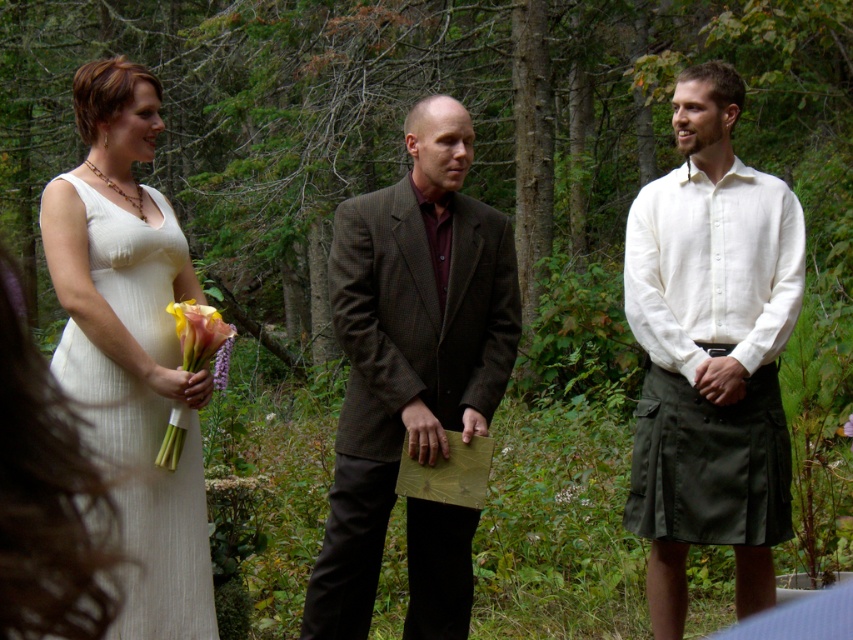
Question: Which point is farther from the camera taking this photo?

Choices:
 (A) (225, 330)
 (B) (213, 636)
 (C) (723, 92)

Answer: (C)

Question: Can you confirm if white linen shirt at center is thinner than soft pastel calla lilies at left?

Choices:
 (A) yes
 (B) no

Answer: (B)

Question: Can you confirm if brown wool suit at center is smaller than soft pink calla lily at left?

Choices:
 (A) yes
 (B) no

Answer: (B)

Question: Which is farther from the white linen shirt at center?

Choices:
 (A) soft pastel calla lilies at left
 (B) soft pink calla lily at left

Answer: (A)

Question: Can you confirm if white textured dress at left is smaller than soft pastel calla lilies at left?

Choices:
 (A) yes
 (B) no

Answer: (B)

Question: Which of the following is the closest to the observer?

Choices:
 (A) (175, 467)
 (B) (688, 298)
 (C) (190, 340)
 (D) (84, 196)

Answer: (C)